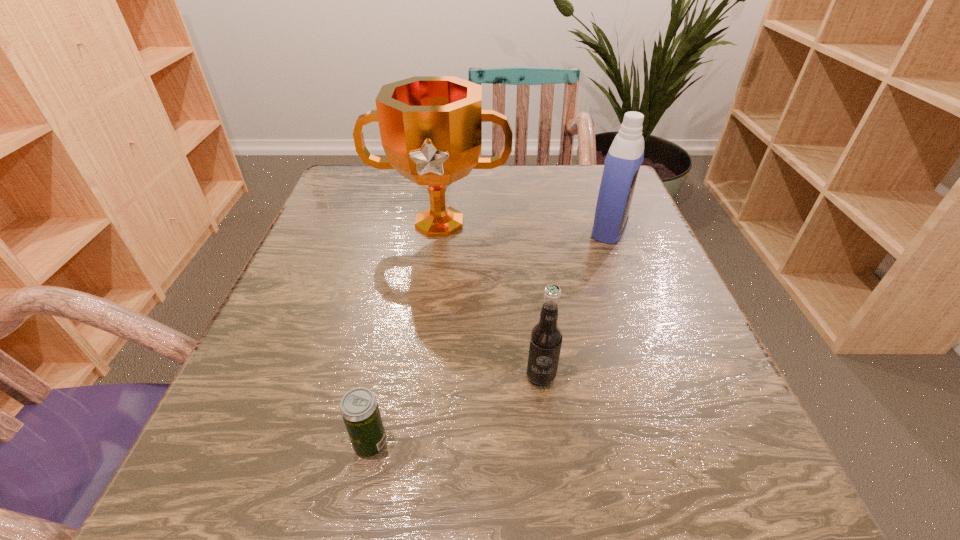
Identify the location of award located in the far edge section of the desktop. This screenshot has height=540, width=960. (431, 126).

This screenshot has width=960, height=540. Find the location of `detergent that is positioned at the far edge`. detergent that is positioned at the far edge is located at coordinates (625, 156).

Locate an element on the screen. The image size is (960, 540). object that is at the near edge is located at coordinates (359, 408).

Find the location of a particular element. The height and width of the screenshot is (540, 960). object present at the left edge is located at coordinates (431, 126).

Identify the location of object positioned at the right edge. The width and height of the screenshot is (960, 540). (625, 156).

Identify the location of object positioned at the far left corner. (431, 126).

Where is `object located in the far right corner section of the desktop`? The width and height of the screenshot is (960, 540). object located in the far right corner section of the desktop is located at coordinates (625, 156).

This screenshot has width=960, height=540. Find the location of `vacant space at the far edge of the desktop`. vacant space at the far edge of the desktop is located at coordinates (524, 184).

Image resolution: width=960 pixels, height=540 pixels. In the image, there is a desktop. Find the location of `vacant space at the near edge`. vacant space at the near edge is located at coordinates (595, 509).

What are the coordinates of `free space at the left edge` in the screenshot? It's located at (326, 217).